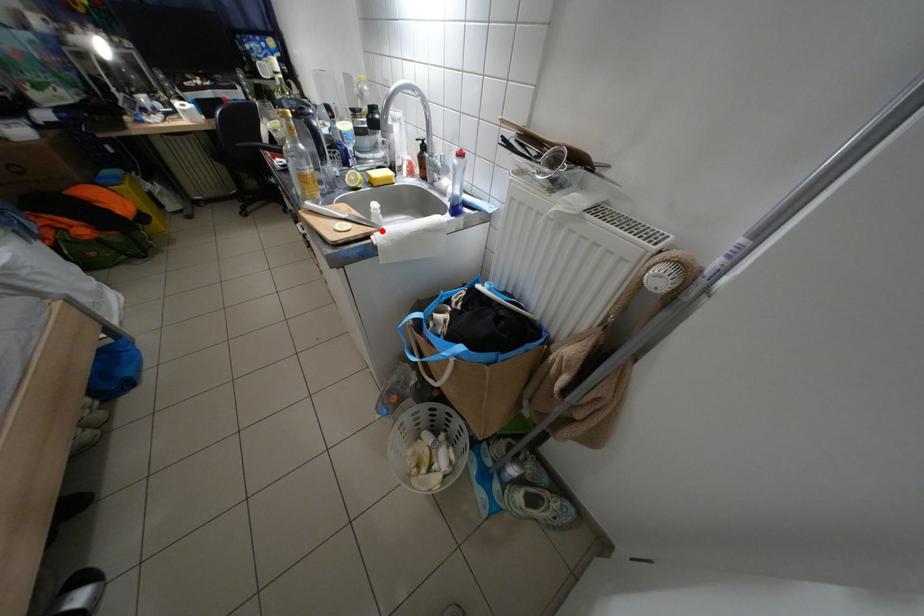
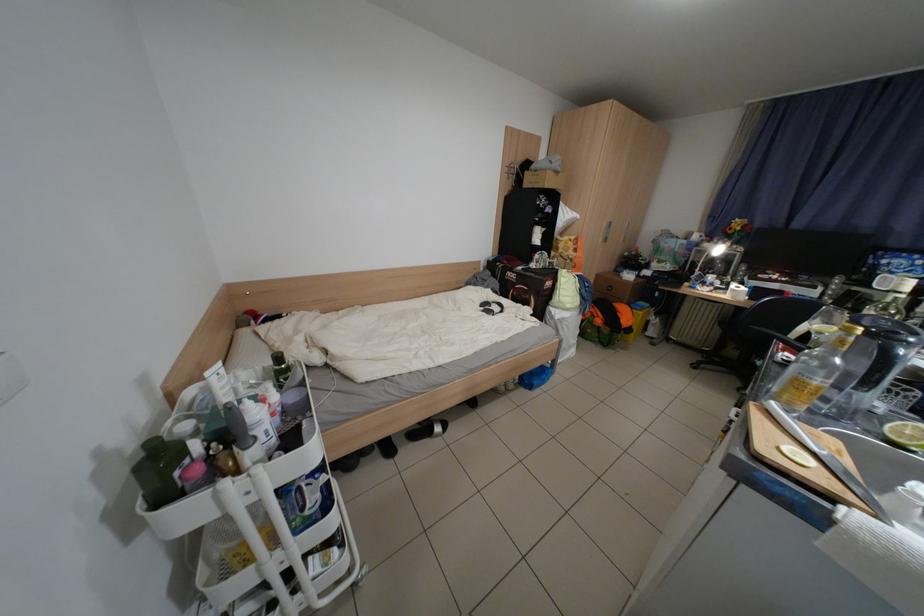
Question: I am providing you with two images of the same scene from different viewpoints. Image1 has a red point marked. In image2, the corresponding 3D location appears at what relative position? Reply with the corresponding letter.

Choices:
 (A) Closer
 (B) Farther

Answer: (A)